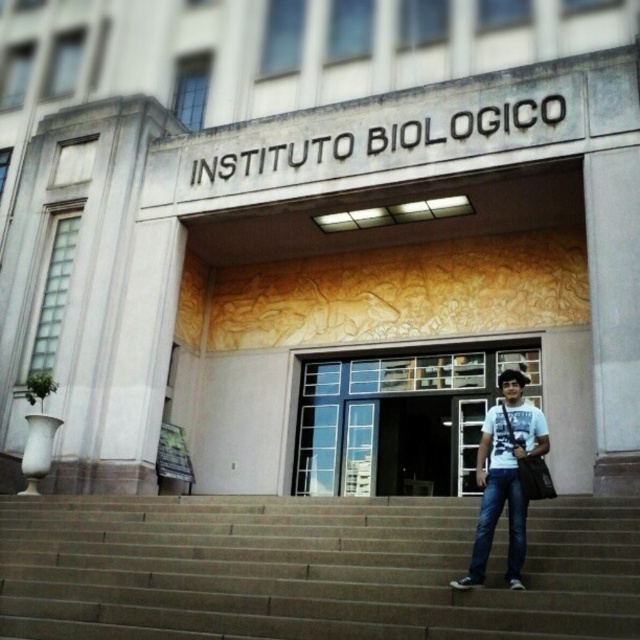
Can you confirm if brown concrete stairs at center is positioned to the right of clear glass door at center?

In fact, brown concrete stairs at center is to the left of clear glass door at center.

Who is positioned more to the left, brown concrete stairs at center or clear glass door at center?

brown concrete stairs at center

Where is `brown concrete stairs at center`? brown concrete stairs at center is located at coordinates (307, 568).

Find the location of a particular element. Image resolution: width=640 pixels, height=640 pixels. brown concrete stairs at center is located at coordinates (307, 568).

Between white cotton t-shirt at center and jeans at center, which one appears on the right side from the viewer's perspective?

Positioned to the right is white cotton t-shirt at center.

Who is positioned more to the left, white cotton t-shirt at center or jeans at center?

jeans at center

Where is `white cotton t-shirt at center`? Image resolution: width=640 pixels, height=640 pixels. white cotton t-shirt at center is located at coordinates (504, 477).

Find the location of a particular element. The width and height of the screenshot is (640, 640). white cotton t-shirt at center is located at coordinates (504, 477).

Can you confirm if brown concrete stairs at center is wider than jeans at center?

Correct, the width of brown concrete stairs at center exceeds that of jeans at center.

Who is shorter, brown concrete stairs at center or jeans at center?

Standing shorter between the two is brown concrete stairs at center.

Between point (125, 545) and point (516, 563), which one is positioned behind?

Positioned behind is point (125, 545).

Identify the location of brown concrete stairs at center. This screenshot has width=640, height=640. (307, 568).